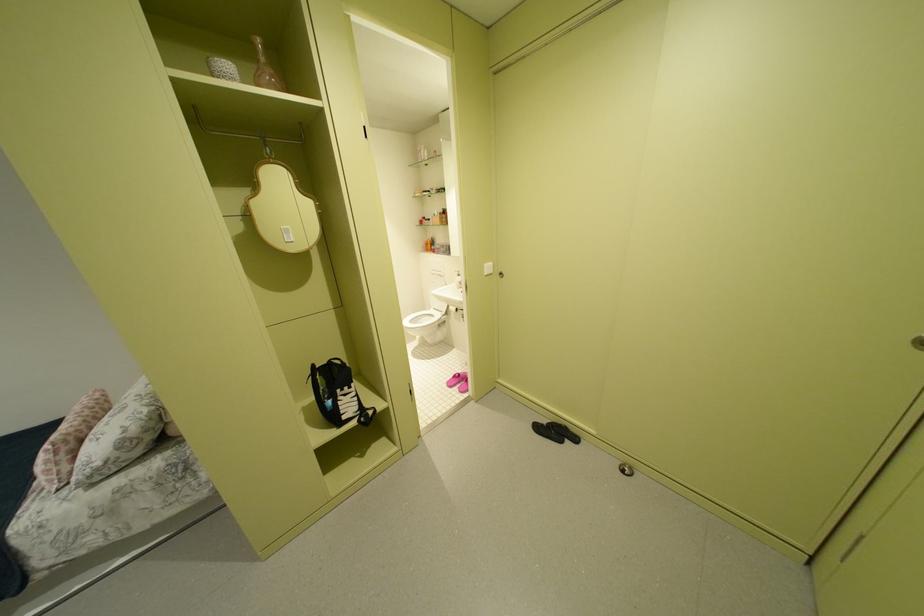
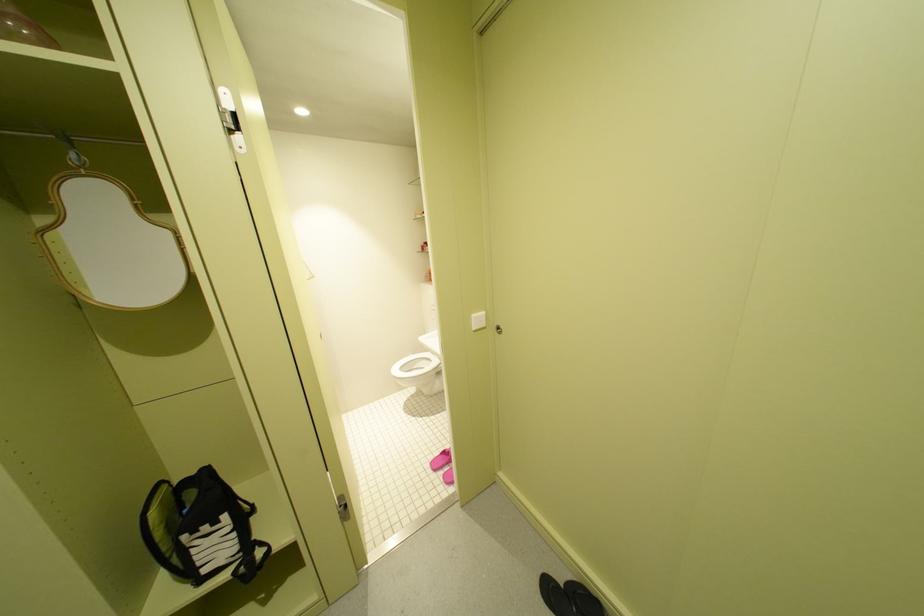
Question: How did the camera likely rotate?

Choices:
 (A) Left
 (B) Right
 (C) Up
 (D) Down

Answer: (A)